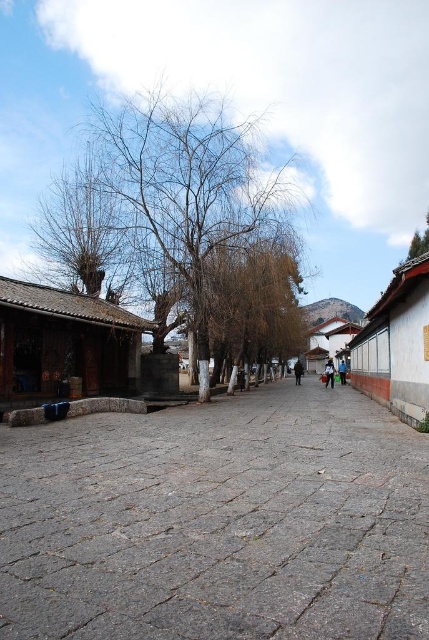
You are standing on the cobblestone pathway in the scene and see the green fabric bag at center. If you were to walk directly towards the bag, which direction should you head? Please provide your answer in terms of compass directions like north, south, east, west, or their combinations.

The green fabric bag at center is located at point 0.583 on the x axis and 0.767 on the y axis. Since the coordinate system typically places (0, 0) at the bottom left corner, moving towards the bag would require heading northeast from your current position on the cobblestone pathway.

You are a tourist walking along the cobblestone pathway in the traditional street scene. You notice a green fabric bag at center and some bare branches at upper left. Which object is positioned higher in the image?

The bare branches at upper left are positioned higher than the green fabric bag at center in the image.

You are a traveler who just arrived at this traditional street. You see two jackets hanging on a rack between the black leather jacket at center and the blue denim jacket at center. Which jacket would you choose if you want the one that covers more of your body?

The black leather jacket at center is larger in size than the blue denim jacket at center, so you should choose the black leather jacket at center to cover more of your body.